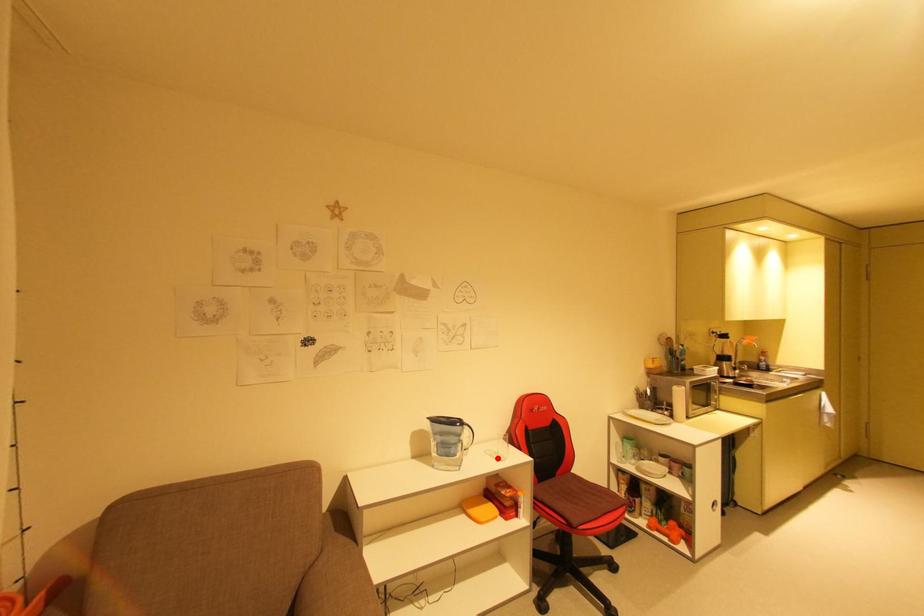
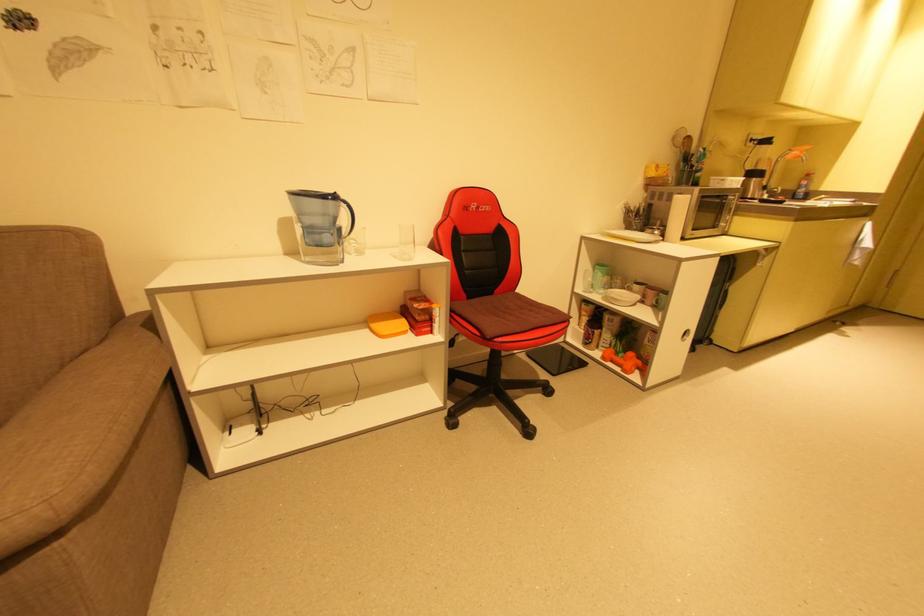
Locate, in the second image, the point that corresponds to the highlighted location in the first image.

(400, 257)